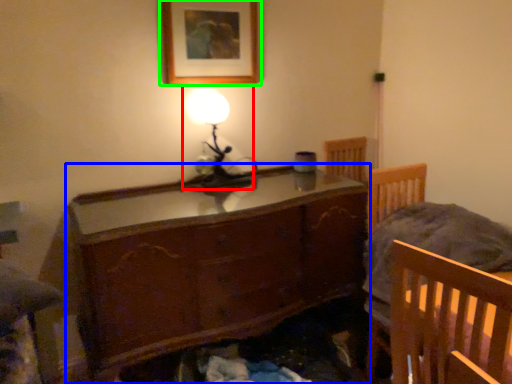
Question: Which is farther away from table lamp (highlighted by a red box)? chest of drawers (highlighted by a blue box) or picture frame (highlighted by a green box)?

Choices:
 (A) chest of drawers
 (B) picture frame

Answer: (A)